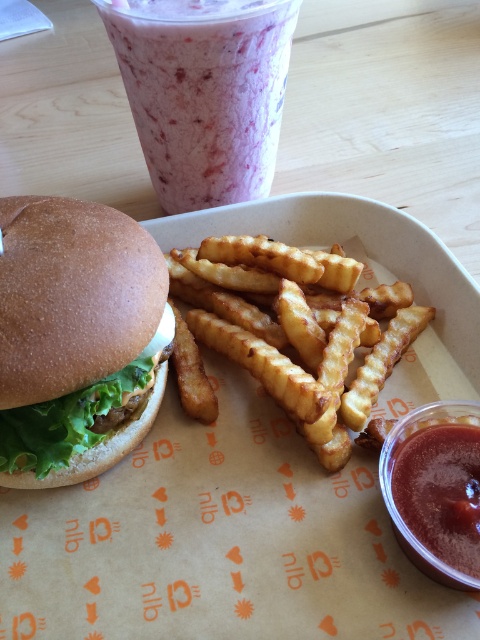
Question: Is golden crispy fries at center positioned in front of smooth tomato sauce at lower right?

Choices:
 (A) no
 (B) yes

Answer: (A)

Question: Which object is the farthest from the smooth tomato sauce at lower right?

Choices:
 (A) golden crispy fries at center
 (B) pink smoothie at upper center
 (C) brown matte burger at left

Answer: (B)

Question: Is golden crispy fries at center below pink smoothie at upper center?

Choices:
 (A) yes
 (B) no

Answer: (A)

Question: Can you confirm if golden crispy fries at center is wider than pink smoothie at upper center?

Choices:
 (A) yes
 (B) no

Answer: (A)

Question: Which point is closer to the camera?

Choices:
 (A) (298, 326)
 (B) (421, 432)

Answer: (B)

Question: Which point is farther to the camera?

Choices:
 (A) (228, 188)
 (B) (228, 236)
 (C) (17, 291)
 (D) (411, 468)

Answer: (A)